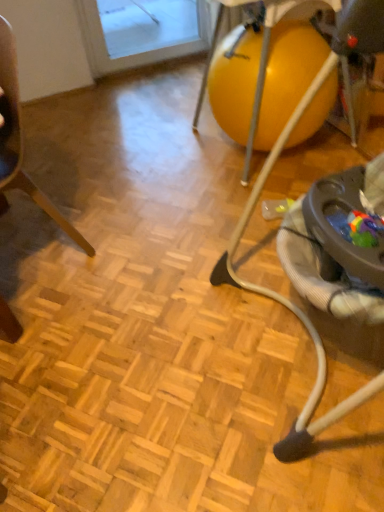
The image size is (384, 512). Identify the location of vacant space in wooden chair at left (from a real-world perspective). (37, 250).